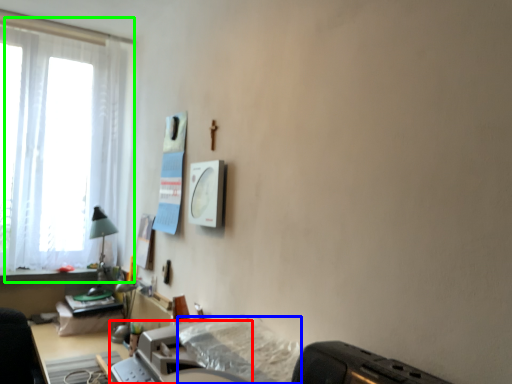
Question: Which object is positioned farthest from printer (highlighted by a red box)? Select from sheet (highlighted by a blue box) and window (highlighted by a green box).

Choices:
 (A) sheet
 (B) window

Answer: (B)